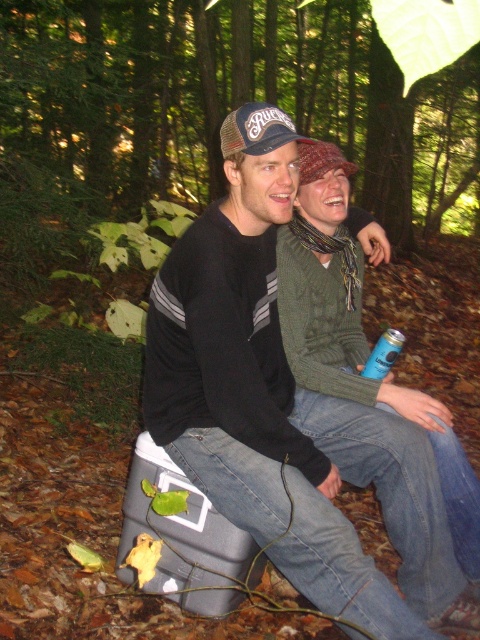
Question: Is black knit sweater at center to the left of green knitted sweater at center from the viewer's perspective?

Choices:
 (A) yes
 (B) no

Answer: (A)

Question: Which object is the farthest from the green knitted sweater at center?

Choices:
 (A) blue matte can at lower center
 (B) black knit sweater at center

Answer: (A)

Question: Does black knit sweater at center appear under green knitted sweater at center?

Choices:
 (A) yes
 (B) no

Answer: (A)

Question: Which object is closer to the camera taking this photo?

Choices:
 (A) green knitted sweater at center
 (B) black knit sweater at center
 (C) blue matte can at lower center

Answer: (B)

Question: Which point is closer to the camera taking this photo?

Choices:
 (A) (349, 288)
 (B) (396, 340)

Answer: (B)

Question: Does green knitted sweater at center appear over blue matte can at lower center?

Choices:
 (A) yes
 (B) no

Answer: (B)